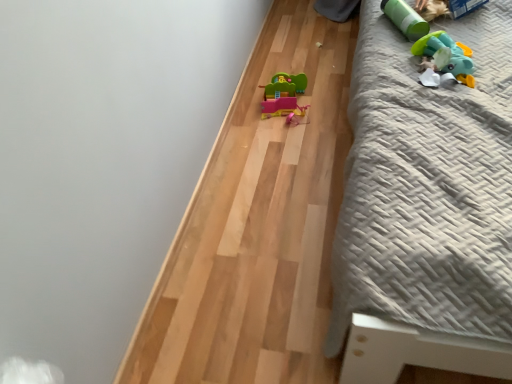
At what (x,y) coordinates should I click in order to perform the action: click on free spot below matte plastic toy car at center, which appears as the first toy when viewed from the left (from a real-world perspective). Please return your answer as a coordinate pair (x, y). Looking at the image, I should click on (288, 107).